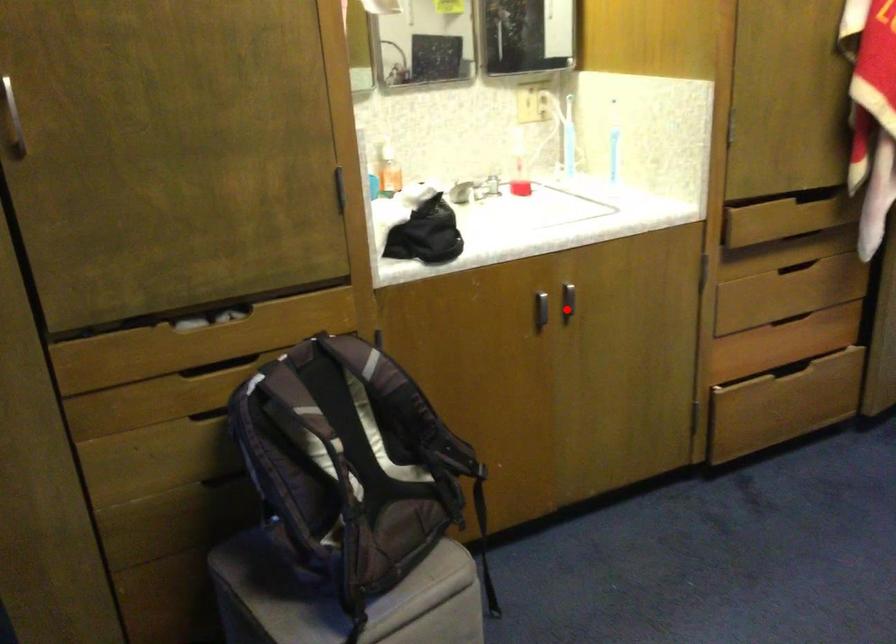
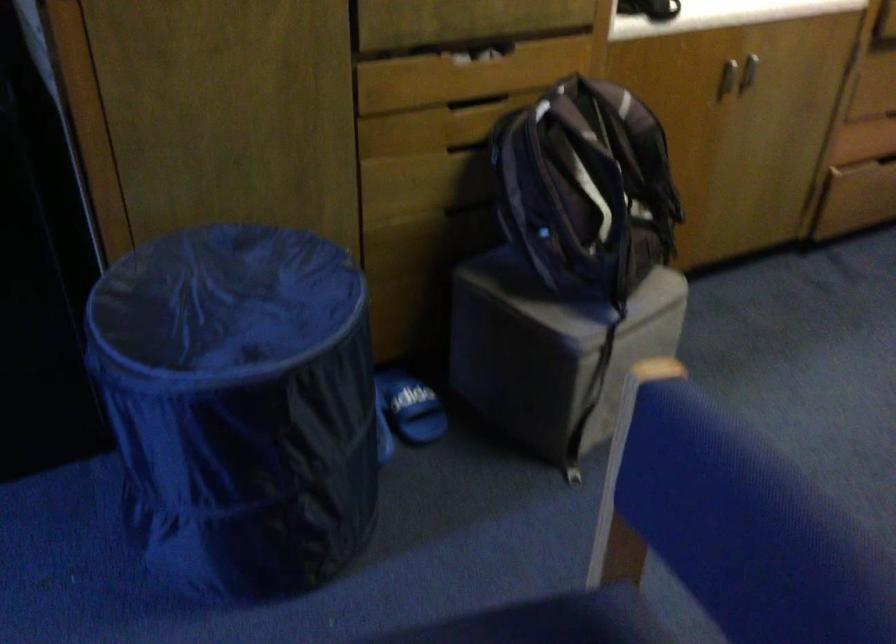
Where in the second image is the point corresponding to the highlighted location from the first image?

(748, 71)